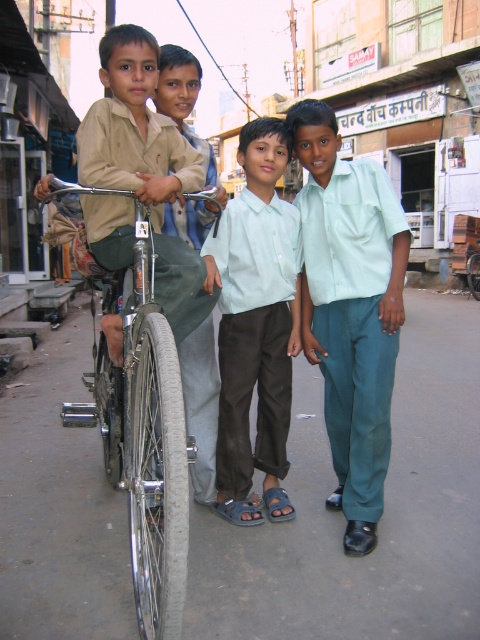
You are standing in the street scene and want to approach the light green fabric shirt at center. If you walk forward 3 meters, will you reach it?

The distance between you and the light green fabric shirt at center is 2.97 meters. If you walk forward 3 meters, you will pass the light green fabric shirt at center by 0.03 meters.

You are a tailor who needs to determine which item can be folded more easily without damaging it. Based on the scene, which object is more suitable for folding? Please refer to the light green cotton shirt at center and the shiny metallic bicycle at left.

The light green cotton shirt at center is thinner than the shiny metallic bicycle at left, so it can be folded more easily without damaging it.